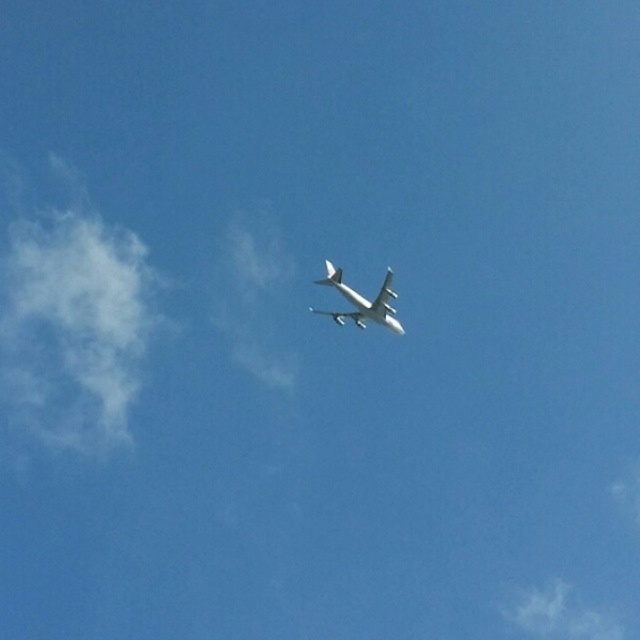
Question: Is white fluffy cloud at left closer to camera compared to white matte airplane at center?

Choices:
 (A) yes
 (B) no

Answer: (B)

Question: Which point appears closest to the camera in this image?

Choices:
 (A) (10, 236)
 (B) (390, 276)
 (C) (557, 618)

Answer: (B)

Question: Among these objects, which one is nearest to the camera?

Choices:
 (A) white matte airplane at center
 (B) white fluffy cloud at upper center

Answer: (A)

Question: Is white fluffy cloud at left closer to the viewer compared to white fluffy cloud at upper center?

Choices:
 (A) no
 (B) yes

Answer: (B)

Question: Which of the following is the farthest from the observer?

Choices:
 (A) (138, 321)
 (B) (326, 266)

Answer: (A)

Question: Is white fluffy cloud at upper center further to the viewer compared to white matte airplane at center?

Choices:
 (A) no
 (B) yes

Answer: (B)